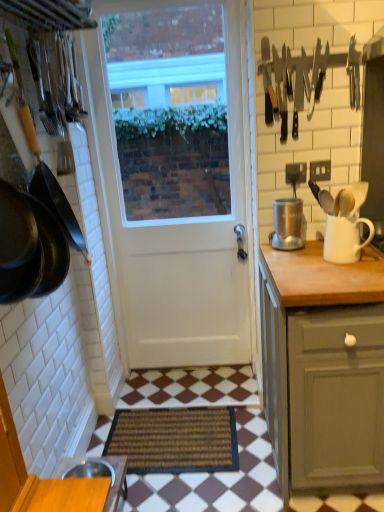
Question: From the image's perspective, relative to white matte door at center, is white glossy jug at right above or below?

Choices:
 (A) below
 (B) above

Answer: (A)

Question: Considering the positions of white glossy jug at right and white matte door at center in the image, is white glossy jug at right wider or thinner than white matte door at center?

Choices:
 (A) thin
 (B) wide

Answer: (B)

Question: Based on their relative distances, which object is nearer to the silver metallic coffee grinder at right?

Choices:
 (A) wooden table at lower left
 (B) matte gray cabinet at right
 (C) black matte frying pan at left
 (D) white glossy jug at right
 (E) stainless steel knives at upper right

Answer: (D)

Question: Which object is positioned farthest from the brown woven mat at center?

Choices:
 (A) matte gray cabinet at right
 (B) wooden table at lower left
 (C) stainless steel knives at upper right
 (D) white glossy jug at right
 (E) silver metallic coffee grinder at right

Answer: (C)